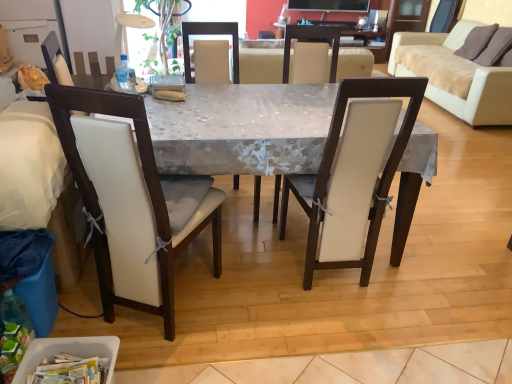
From the picture: Measure the distance between white leather studio couch at left, which is counted as the second studio couch, starting from the top, and camera.

white leather studio couch at left, which is counted as the second studio couch, starting from the top, and camera are 1.58 meters apart.

At what (x,y) coordinates should I click in order to perform the action: click on white leather chair at center, which is counted as the 3th chair, starting from the right. Please return your answer as a coordinate pair (x, y). The image size is (512, 384). Looking at the image, I should click on (210, 53).

What is the approximate height of white plastic container at lower left?

white plastic container at lower left is 9.33 inches in height.

Locate an element on the screen. matte white table at center is located at coordinates (243, 130).

Describe the element at coordinates (311, 38) in the screenshot. I see `white fabric chair at center, the third chair in the left-to-right sequence` at that location.

You are a GUI agent. You are given a task and a screenshot of the screen. Output one action in this format:
    pyautogui.click(x=<x>, y=<y>)
    Task: Click on the white fabric chair at center, the third chair in the left-to-right sequence
    
    Given the screenshot: What is the action you would take?
    tap(311, 38)

The image size is (512, 384). What are the coordinates of `white leather studio couch at left, marked as the second studio couch in a right-to-left arrangement` in the screenshot? It's located at (40, 184).

Between matte white table at center and clear plastic bottle at table left, which one appears on the right side from the viewer's perspective?

Positioned to the right is matte white table at center.

From the image's perspective, would you say matte white table at center is positioned over clear plastic bottle at table left?

No, from the image's perspective, matte white table at center is not on top of clear plastic bottle at table left.

Is matte white table at center spatially inside clear plastic bottle at table left, or outside of it?

matte white table at center lies outside clear plastic bottle at table left.

How different are the orientations of matte white table at center and clear plastic bottle at table left in degrees?

matte white table at center and clear plastic bottle at table left are facing 1.71e-05 degrees away from each other.

Looking at this image, is white leather studio couch at left, which is counted as the 1th studio couch, starting from the bottom, wider or thinner than white plastic container at lower left?

Considering their sizes, white leather studio couch at left, which is counted as the 1th studio couch, starting from the bottom, looks broader than white plastic container at lower left.

Is white leather studio couch at left, marked as the 1th studio couch in a left-to-right arrangement, far from white plastic container at lower left?

No, white leather studio couch at left, marked as the 1th studio couch in a left-to-right arrangement, is in close proximity to white plastic container at lower left.

From the image's perspective, which is below, white leather studio couch at left, which is the 1th studio couch from front to back, or white plastic container at lower left?

From the image's view, white plastic container at lower left is below.

From a real-world perspective, is white leather studio couch at left, which is the 1th studio couch from front to back, under white plastic container at lower left?

Incorrect, from a real-world perspective, white leather studio couch at left, which is the 1th studio couch from front to back, is higher than white plastic container at lower left.

Who is bigger, white leather chair at center, placed as the first chair when sorted from right to left, or brown fabric pillow at upper right?

white leather chair at center, placed as the first chair when sorted from right to left.

Is white leather chair at center, acting as the fourth chair starting from the left, inside or outside of brown fabric pillow at upper right?

The correct answer is: outside.

Is there a large distance between white leather chair at center, placed as the first chair when sorted from right to left, and brown fabric pillow at upper right?

Yes, white leather chair at center, placed as the first chair when sorted from right to left, and brown fabric pillow at upper right are located far from each other.

Considering the sizes of objects white plastic container at lower left and brown fabric pillow at upper right in the image provided, who is smaller, white plastic container at lower left or brown fabric pillow at upper right?

Smaller between the two is white plastic container at lower left.

From the image's perspective, relative to brown fabric pillow at upper right, is white plastic container at lower left above or below?

Clearly, from the image's perspective, white plastic container at lower left is below brown fabric pillow at upper right.

Who is more distant, white plastic container at lower left or brown fabric pillow at upper right?

Positioned behind is brown fabric pillow at upper right.

Can you confirm if white plastic container at lower left is taller than brown fabric pillow at upper right?

Result: No, white plastic container at lower left is not taller than brown fabric pillow at upper right.

Looking at this image, between white leather chair at center, which is counted as the 3th chair, starting from the right, and white leather studio couch at left, which is counted as the 1th studio couch, starting from the bottom, which one appears on the right side from the viewer's perspective?

white leather chair at center, which is counted as the 3th chair, starting from the right.

From a real-world perspective, which is physically above, white leather chair at center, which is counted as the 3th chair, starting from the right, or white leather studio couch at left, marked as the second studio couch in a right-to-left arrangement?

white leather studio couch at left, marked as the second studio couch in a right-to-left arrangement, is physically above.

From the image's perspective, is white leather chair at center, which is the second chair from left to right, located beneath white leather studio couch at left, which is the 1th studio couch from front to back?

Actually, white leather chair at center, which is the second chair from left to right, appears above white leather studio couch at left, which is the 1th studio couch from front to back, in the image.

Between white plastic container at lower left and white fabric chair at center, the third chair in the left-to-right sequence, which one has smaller width?

Thinner between the two is white plastic container at lower left.

From the image's perspective, relative to white fabric chair at center, which ranks as the second chair in right-to-left order, is white plastic container at lower left above or below?

white plastic container at lower left is situated lower than white fabric chair at center, which ranks as the second chair in right-to-left order, in the image.

Is white plastic container at lower left aimed at white fabric chair at center, the third chair in the left-to-right sequence?

No, white plastic container at lower left is not turned towards white fabric chair at center, the third chair in the left-to-right sequence.

Which object is further away from the camera, white plastic container at lower left or white fabric chair at center, the third chair in the left-to-right sequence?

white fabric chair at center, the third chair in the left-to-right sequence.

Based on the photo, from the image's perspective, which one is positioned higher, white leather chair at center, placed as the first chair when sorted from right to left, or beige fabric couch at upper right, the first studio couch positioned from the back?

From the image's view, beige fabric couch at upper right, the first studio couch positioned from the back, is above.

From a real-world perspective, is white leather chair at center, placed as the first chair when sorted from right to left, physically above beige fabric couch at upper right, the 1th studio couch viewed from the top?

Indeed, from a real-world perspective, white leather chair at center, placed as the first chair when sorted from right to left, stands above beige fabric couch at upper right, the 1th studio couch viewed from the top.

You are a GUI agent. You are given a task and a screenshot of the screen. Output one action in this format:
    pyautogui.click(x=<x>, y=<y>)
    Task: Click on the studio couch behind the white leather chair at center, acting as the fourth chair starting from the left
    This screenshot has height=384, width=512.
    Given the screenshot: What is the action you would take?
    pyautogui.click(x=454, y=76)

The image size is (512, 384). Identify the location of bottle above the matte white table at center (from the image's perspective). (126, 76).

The width and height of the screenshot is (512, 384). In order to click on trash bin/can in front of the white leather studio couch at left, marked as the 1th studio couch in a left-to-right arrangement in this screenshot , I will do `click(68, 352)`.

Which object lies nearer to the anchor point white leather chair at center, placed as the first chair when sorted from right to left, white leather chair at left, which is the 4th chair from right to left, or brown fabric pillow at upper right?

Based on the image, white leather chair at left, which is the 4th chair from right to left, appears to be nearer to white leather chair at center, placed as the first chair when sorted from right to left.

When comparing their distances from white plastic container at lower left, does beige fabric couch at upper right, marked as the 2th studio couch in a left-to-right arrangement, or clear plastic bottle at table left seem closer?

Based on the image, clear plastic bottle at table left appears to be nearer to white plastic container at lower left.

Looking at the image, which one is located closer to matte white table at center, white fabric chair at center, the third chair in the left-to-right sequence, or clear plastic bottle at table left?

Based on the image, white fabric chair at center, the third chair in the left-to-right sequence, appears to be nearer to matte white table at center.

Based on their spatial positions, is matte white table at center or clear plastic bottle at table left further from white plastic container at lower left?

The object further to white plastic container at lower left is clear plastic bottle at table left.

Which object lies nearer to the anchor point white fabric chair at center, which ranks as the second chair in right-to-left order, white leather studio couch at left, which is counted as the second studio couch, starting from the top, or white leather chair at left, which is the 1th chair in left-to-right order?

The object closer to white fabric chair at center, which ranks as the second chair in right-to-left order, is white leather chair at left, which is the 1th chair in left-to-right order.

Looking at the image, which one is located further to beige fabric couch at upper right, the second studio couch positioned from the bottom, white leather chair at left, which is the 4th chair from right to left, or white leather chair at center, placed as the first chair when sorted from right to left?

The object further to beige fabric couch at upper right, the second studio couch positioned from the bottom, is white leather chair at left, which is the 4th chair from right to left.

Considering their positions, is brown fabric pillow at upper right positioned closer to beige fabric couch at upper right, which ranks as the 2th studio couch in front-to-back order, than white fabric chair at center, the third chair in the left-to-right sequence?

Among the two, brown fabric pillow at upper right is located nearer to beige fabric couch at upper right, which ranks as the 2th studio couch in front-to-back order.

Based on their spatial positions, is matte white table at center or brown fabric pillow at upper right further from white fabric chair at center, the third chair in the left-to-right sequence?

The object further to white fabric chair at center, the third chair in the left-to-right sequence, is brown fabric pillow at upper right.

Locate an element on the screen. This screenshot has height=384, width=512. trash bin/can between white leather studio couch at left, which is the 1th studio couch from front to back, and white fabric chair at center, the third chair in the left-to-right sequence, in the horizontal direction is located at coordinates (68, 352).

At what (x,y) coordinates should I click in order to perform the action: click on desk between white leather chair at left, which is the 4th chair from right to left, and white leather chair at center, which is counted as the 3th chair, starting from the right, from front to back. Please return your answer as a coordinate pair (x, y). Looking at the image, I should click on (243, 130).

This screenshot has width=512, height=384. I want to click on bottle between white leather studio couch at left, which is the 1th studio couch from front to back, and matte white table at center from left to right, so click(126, 76).

The height and width of the screenshot is (384, 512). In order to click on bottle between white leather studio couch at left, marked as the second studio couch in a right-to-left arrangement, and brown fabric pillow at upper right from left to right in this screenshot , I will do `click(126, 76)`.